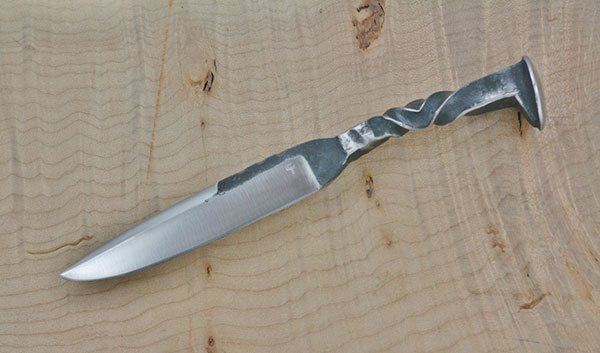
Locate an element on the screen. Image resolution: width=600 pixels, height=353 pixels. handle is located at coordinates (440, 102).